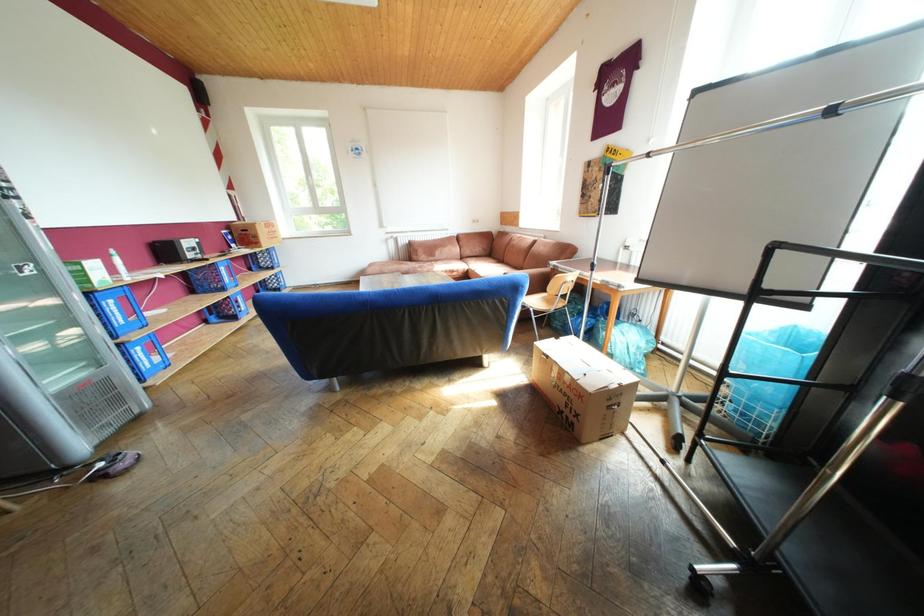
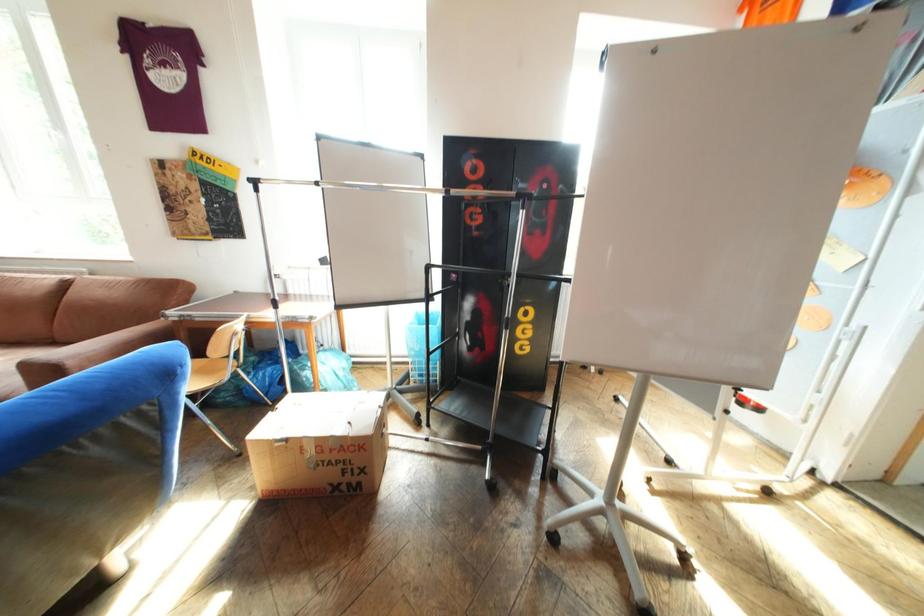
Question: The camera is either moving clockwise (left) or counter-clockwise (right) around the object. The first image is from the beginning of the video and the second image is from the end. Is the camera moving left or right when shooting the video?

Choices:
 (A) Left
 (B) Right

Answer: (A)